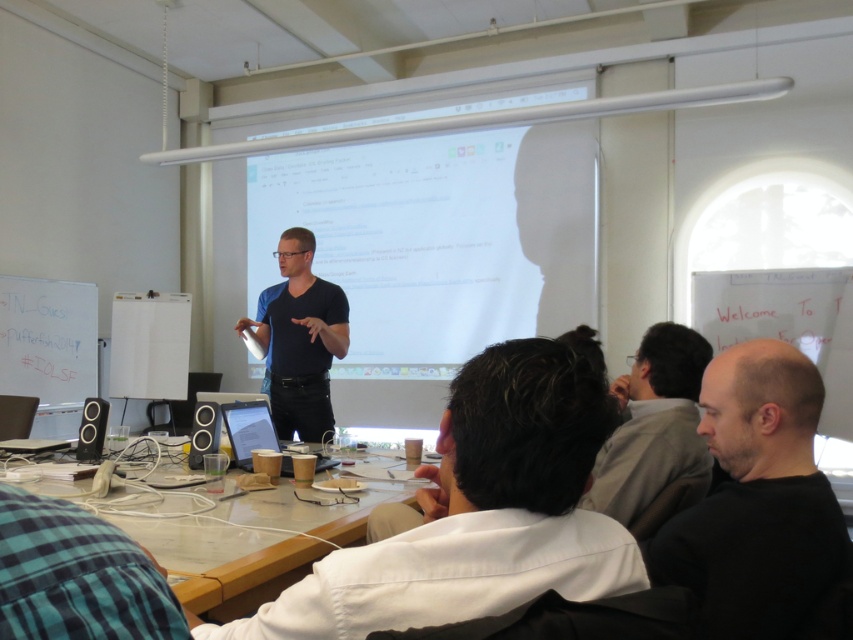
You are an attendee at the presentation. You need to pass a note to the person sitting next to you. The note is as big as the wooden table at lower center. Can the white cotton shirt at center hold the note?

The white cotton shirt at center is bigger than the wooden table at lower center. Since the note is as big as the wooden table at lower center, the white cotton shirt at center can hold the note.

You are sitting at the back of the conference room and want to hand a document to the presenter wearing the white cotton shirt at center. If your arm can reach 30 inches, can you reach them without getting up?

The distance between you and the white cotton shirt at center is 29.52 inches, so yes, you can reach them with your arm since it is slightly shorter than your reach.